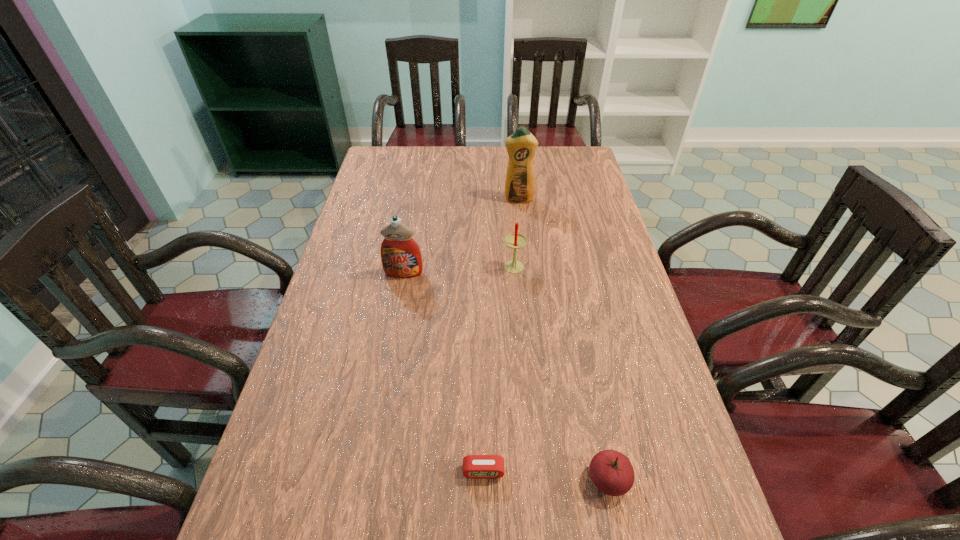
Where is `vacant area situated 0.260m on the front surface of the leftmost object`? The height and width of the screenshot is (540, 960). vacant area situated 0.260m on the front surface of the leftmost object is located at coordinates (390, 352).

You are a GUI agent. You are given a task and a screenshot of the screen. Output one action in this format:
    pyautogui.click(x=<x>, y=<y>)
    Task: Click on the free space located on the right of the third tallest object
    
    Given the screenshot: What is the action you would take?
    pyautogui.click(x=548, y=269)

Locate an element on the screen. The image size is (960, 540). vacant space located on the back of the tomato is located at coordinates (582, 348).

The width and height of the screenshot is (960, 540). I want to click on vacant space situated on the front-facing side of the fourth object from right to left, so click(x=484, y=536).

Where is `object that is positioned at the left edge`? object that is positioned at the left edge is located at coordinates (401, 257).

This screenshot has width=960, height=540. In order to click on object situated at the right edge in this screenshot , I will do `click(612, 473)`.

Identify the location of vacant space at the far edge of the desktop. (488, 176).

In order to click on free space at the left edge in this screenshot , I will do `click(342, 254)`.

The height and width of the screenshot is (540, 960). What are the coordinates of `vacant point at the right edge` in the screenshot? It's located at (576, 194).

The height and width of the screenshot is (540, 960). In order to click on vacant space at the far left corner of the desktop in this screenshot , I will do `click(378, 175)`.